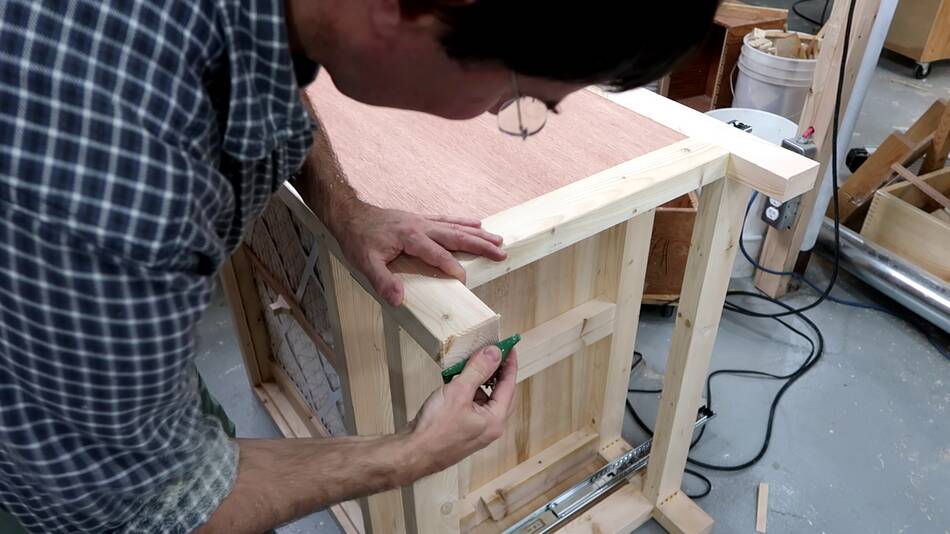
Image resolution: width=950 pixels, height=534 pixels. I want to click on concrete floor, so click(x=846, y=429).